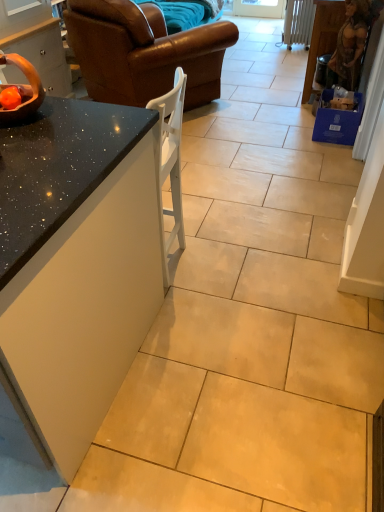
Question: Is point (54, 342) positioned closer to the camera than point (324, 37)?

Choices:
 (A) closer
 (B) farther

Answer: (A)

Question: From a real-world perspective, is black granite countertop at left, the first countertop in the left-to-right sequence, positioned above or below wooden statue at right, the 1th cabinetry in the right-to-left sequence?

Choices:
 (A) below
 (B) above

Answer: (B)

Question: Which is farther from the black granite countertop at left, which ranks as the second countertop in right-to-left order?

Choices:
 (A) matte black bowl at left, which is counted as the second cabinetry, starting from the right
 (B) speckled granite countertop at center-left, placed as the 2th countertop when sorted from left to right
 (C) brown leather couch at upper left
 (D) wooden bowl at upper left
 (E) wooden statue at right, acting as the 2th cabinetry starting from the left

Answer: (E)

Question: Estimate the real-world distances between objects in this image. Which object is farther from the brown leather couch at upper left?

Choices:
 (A) wooden bowl at upper left
 (B) matte black bowl at left, which appears as the 1th cabinetry when viewed from the left
 (C) speckled granite countertop at center-left, placed as the 2th countertop when sorted from left to right
 (D) black granite countertop at left, which ranks as the second countertop in right-to-left order
 (E) wooden statue at right, acting as the 2th cabinetry starting from the left

Answer: (D)